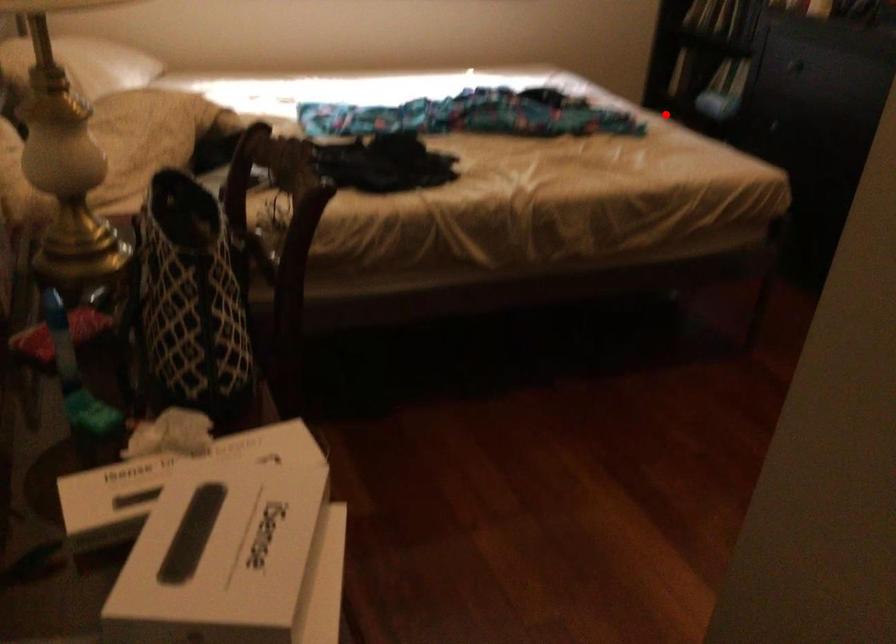
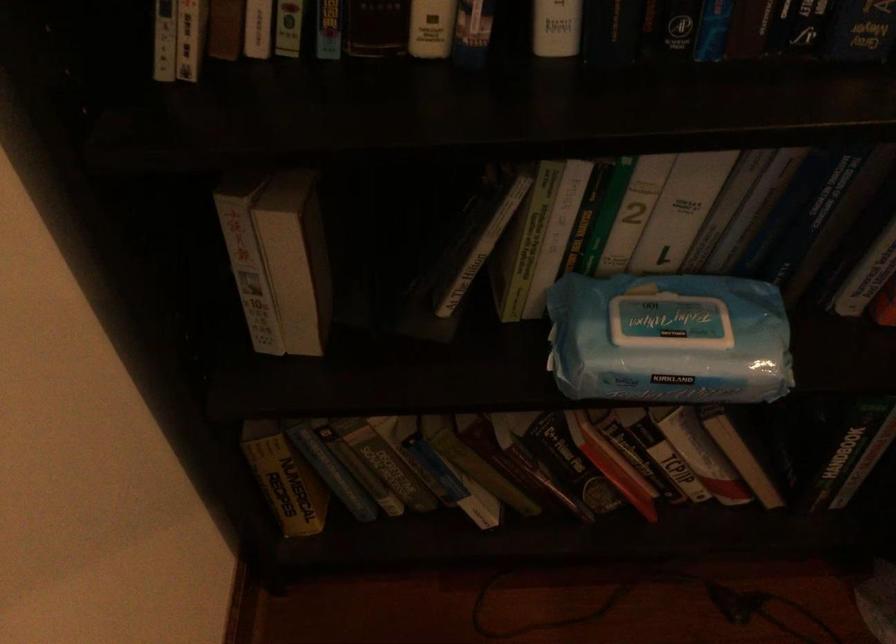
Question: A red point is marked in image1. In image2, is the corresponding 3D point closer to the camera or farther? Reply with the corresponding letter.

Choices:
 (A) The corresponding 3D point is closer.
 (B) The corresponding 3D point is farther.

Answer: (A)